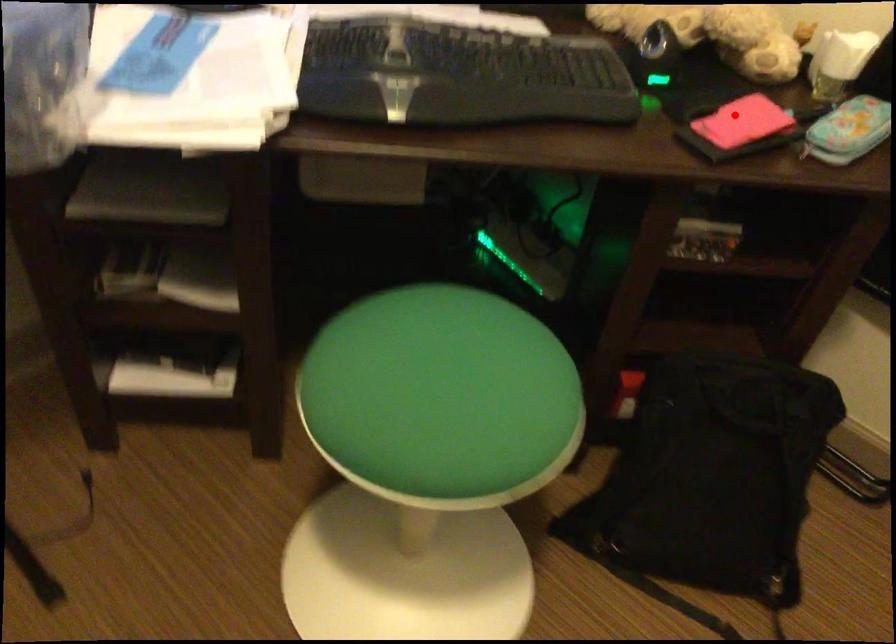
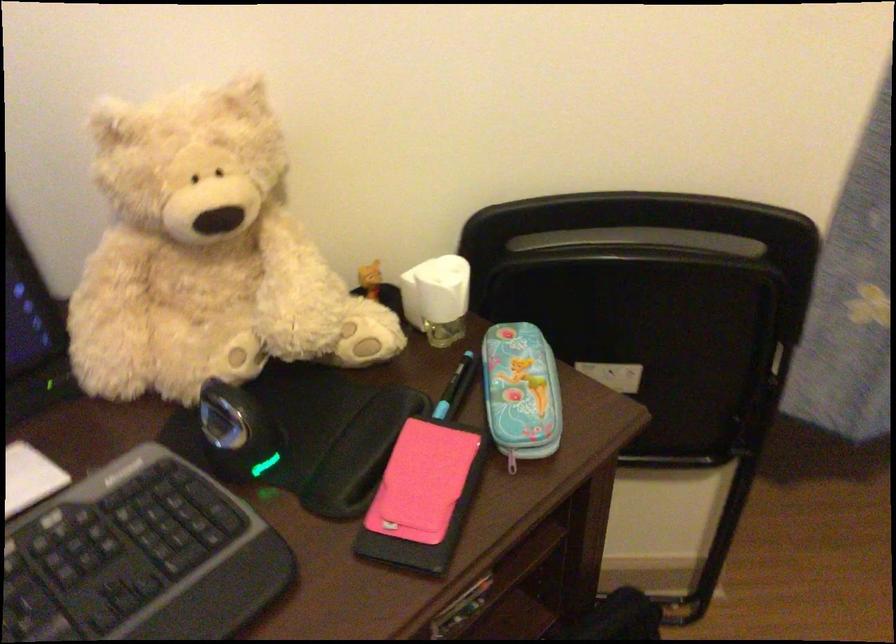
Question: I am providing you with two images of the same scene from different viewpoints. Image1 has a red point marked. In image2, the corresponding 3D location appears at what relative position? Reply with the corresponding letter.

Choices:
 (A) Closer
 (B) Farther

Answer: (A)